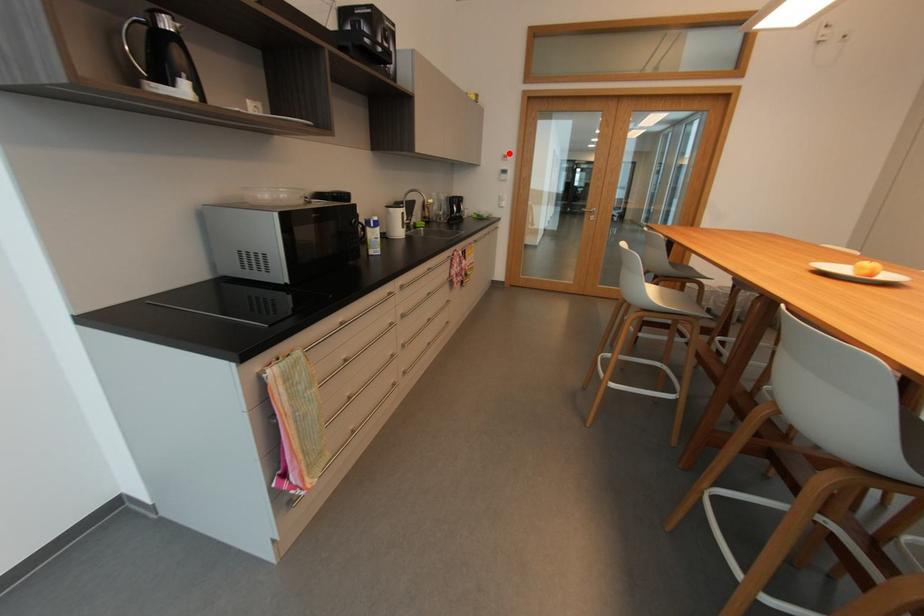
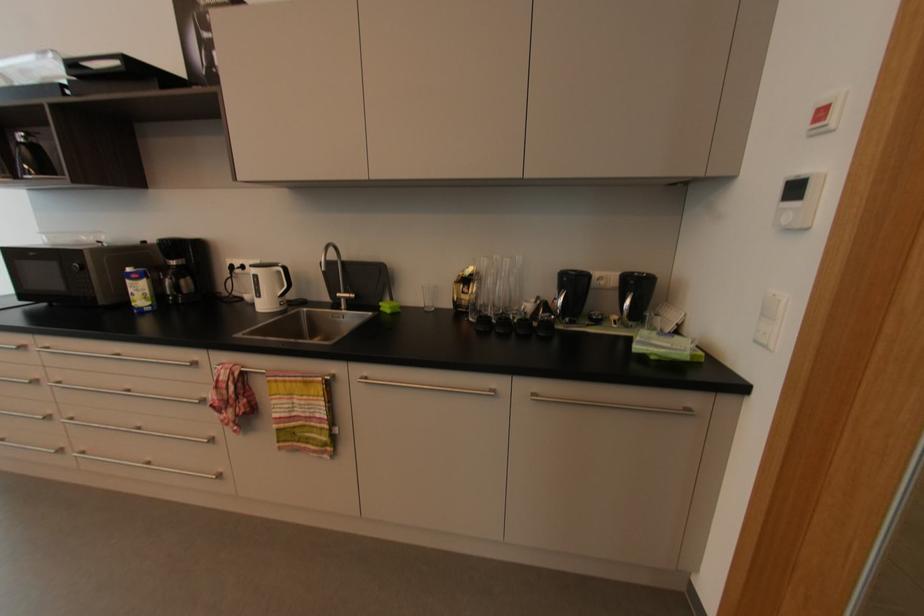
Question: A red point is marked in image1. In image2, is the corresponding 3D point closer to the camera or farther? Reply with the corresponding letter.

Choices:
 (A) The corresponding 3D point is closer.
 (B) The corresponding 3D point is farther.

Answer: (B)